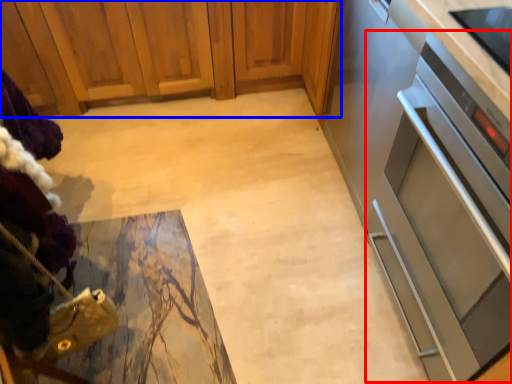
Question: Among these objects, which one is nearest to the camera, oven (highlighted by a red box) or cabinetry (highlighted by a blue box)?

Choices:
 (A) oven
 (B) cabinetry

Answer: (A)